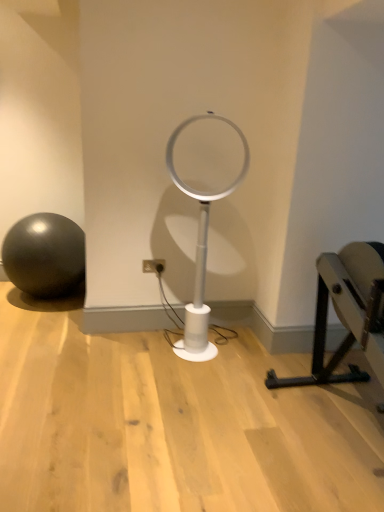
The height and width of the screenshot is (512, 384). I want to click on vacant area situated to the left side of white plastic table lamp at center, so pyautogui.click(x=148, y=349).